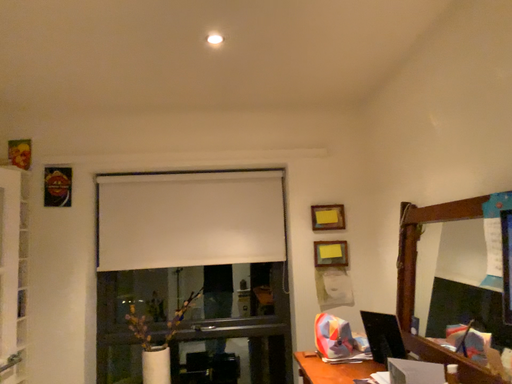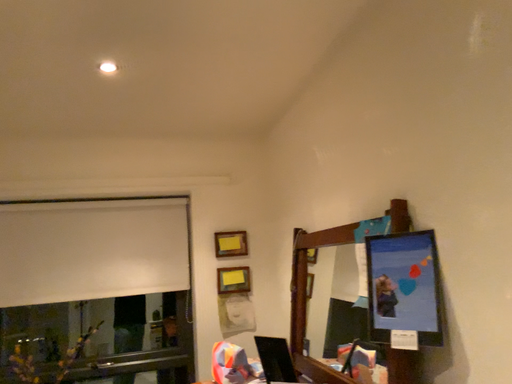
Question: How did the camera likely rotate when shooting the video?

Choices:
 (A) rotated left
 (B) rotated right

Answer: (B)